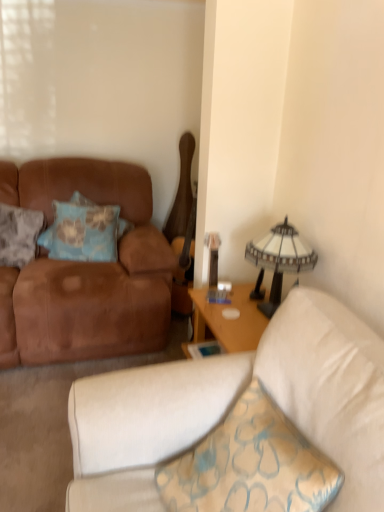
You are a GUI agent. You are given a task and a screenshot of the screen. Output one action in this format:
    pyautogui.click(x=<x>, y=<y>)
    Task: Click on the suede brown couch at left, the 1th studio couch viewed from the front
    
    Given the screenshot: What is the action you would take?
    pyautogui.click(x=230, y=404)

What do you see at coordinates (85, 271) in the screenshot? I see `brown suede couch at left, the 1th studio couch when ordered from back to front` at bounding box center [85, 271].

The width and height of the screenshot is (384, 512). Describe the element at coordinates (279, 260) in the screenshot. I see `white glass lampshade at upper right` at that location.

Image resolution: width=384 pixels, height=512 pixels. What do you see at coordinates (82, 231) in the screenshot?
I see `blue fabric pillow at left, arranged as the 1th pillow when viewed from the right` at bounding box center [82, 231].

Locate an element on the screen. textured blue pillow at left, positioned as the first pillow in left-to-right order is located at coordinates (19, 234).

Is white glass lampshade at upper right looking in the opposite direction of blue fabric pillow at left, arranged as the 1th pillow when viewed from the right?

That's not correct — white glass lampshade at upper right is not looking away from blue fabric pillow at left, arranged as the 1th pillow when viewed from the right.

Based on their sizes in the image, would you say white glass lampshade at upper right is bigger or smaller than blue fabric pillow at left, arranged as the 2th pillow when viewed from the left?

In the image, white glass lampshade at upper right appears to be smaller than blue fabric pillow at left, arranged as the 2th pillow when viewed from the left.

Does white glass lampshade at upper right have a lesser width compared to blue fabric pillow at left, arranged as the 1th pillow when viewed from the right?

Yes, white glass lampshade at upper right is thinner than blue fabric pillow at left, arranged as the 1th pillow when viewed from the right.

From a real-world perspective, relative to blue fabric pillow at left, arranged as the 1th pillow when viewed from the right, is white glass lampshade at upper right vertically above or below?

white glass lampshade at upper right is situated higher than blue fabric pillow at left, arranged as the 1th pillow when viewed from the right, in the real world.

Who is shorter, textured blue pillow at left, positioned as the first pillow in left-to-right order, or blue fabric pillow at left, arranged as the 2th pillow when viewed from the left?

With less height is blue fabric pillow at left, arranged as the 2th pillow when viewed from the left.

Between textured blue pillow at left, the 2th pillow when ordered from right to left, and blue fabric pillow at left, arranged as the 1th pillow when viewed from the right, which one has smaller size?

Smaller between the two is textured blue pillow at left, the 2th pillow when ordered from right to left.

Considering the sizes of textured blue pillow at left, positioned as the first pillow in left-to-right order, and blue fabric pillow at left, arranged as the 2th pillow when viewed from the left, in the image, is textured blue pillow at left, positioned as the first pillow in left-to-right order, wider or thinner than blue fabric pillow at left, arranged as the 2th pillow when viewed from the left,?

Clearly, textured blue pillow at left, positioned as the first pillow in left-to-right order, has more width compared to blue fabric pillow at left, arranged as the 2th pillow when viewed from the left.

What's the angular difference between blue fabric pillow at left, arranged as the 1th pillow when viewed from the right, and suede brown couch at left, the 1th studio couch viewed from the front,'s facing directions?

The facing directions of blue fabric pillow at left, arranged as the 1th pillow when viewed from the right, and suede brown couch at left, the 1th studio couch viewed from the front, are 76.5 degrees apart.

Would you consider blue fabric pillow at left, arranged as the 1th pillow when viewed from the right, to be distant from suede brown couch at left, the 1th studio couch viewed from the front?

Indeed, blue fabric pillow at left, arranged as the 1th pillow when viewed from the right, is not near suede brown couch at left, the 1th studio couch viewed from the front.

Who is smaller, blue fabric pillow at left, arranged as the 2th pillow when viewed from the left, or suede brown couch at left, the 1th studio couch viewed from the front?

blue fabric pillow at left, arranged as the 2th pillow when viewed from the left, is smaller.

Can you see textured blue pillow at left, the 2th pillow when ordered from right to left, touching suede brown couch at left, the second studio couch positioned from the back?

textured blue pillow at left, the 2th pillow when ordered from right to left, and suede brown couch at left, the second studio couch positioned from the back, are not in contact.

Is point (0, 230) less distant than point (136, 398)?

No, it is not.

Can you confirm if textured blue pillow at left, positioned as the first pillow in left-to-right order, is smaller than suede brown couch at left, the second studio couch positioned from the back?

Yes.

Is textured blue pillow at left, positioned as the first pillow in left-to-right order, oriented towards suede brown couch at left, the 1th studio couch viewed from the front?

No, textured blue pillow at left, positioned as the first pillow in left-to-right order, is not turned towards suede brown couch at left, the 1th studio couch viewed from the front.

Is white glass lampshade at upper right facing away from brown suede couch at left, the 1th studio couch when ordered from back to front?

white glass lampshade at upper right does not have its back to brown suede couch at left, the 1th studio couch when ordered from back to front.

What are the coordinates of `the 2nd studio couch to the left when counting from the white glass lampshade at upper right` in the screenshot? It's located at (85, 271).

From the image's perspective, would you say blue fabric pillow at left, arranged as the 1th pillow when viewed from the right, is positioned over brown suede couch at left, acting as the 2th studio couch starting from the front?

Yes, from the image's perspective, blue fabric pillow at left, arranged as the 1th pillow when viewed from the right, is on top of brown suede couch at left, acting as the 2th studio couch starting from the front.

Can you confirm if blue fabric pillow at left, arranged as the 2th pillow when viewed from the left, is positioned to the right of brown suede couch at left, the 1th studio couch when ordered from back to front?

Correct, you'll find blue fabric pillow at left, arranged as the 2th pillow when viewed from the left, to the right of brown suede couch at left, the 1th studio couch when ordered from back to front.

How much distance is there between blue fabric pillow at left, arranged as the 1th pillow when viewed from the right, and brown suede couch at left, acting as the 2th studio couch starting from the front?

A distance of 10.60 inches exists between blue fabric pillow at left, arranged as the 1th pillow when viewed from the right, and brown suede couch at left, acting as the 2th studio couch starting from the front.

Based on their sizes in the image, would you say blue fabric pillow at left, arranged as the 2th pillow when viewed from the left, is bigger or smaller than brown suede couch at left, the 1th studio couch when ordered from back to front?

blue fabric pillow at left, arranged as the 2th pillow when viewed from the left, is smaller than brown suede couch at left, the 1th studio couch when ordered from back to front.

Is point (136, 263) closer or farther from the camera than point (285, 222)?

Clearly, point (136, 263) is more distant from the camera than point (285, 222).

Can you confirm if brown suede couch at left, acting as the 2th studio couch starting from the front, is wider than white glass lampshade at upper right?

Yes.

Which object is positioned more to the right, brown suede couch at left, acting as the 2th studio couch starting from the front, or white glass lampshade at upper right?

Positioned to the right is white glass lampshade at upper right.

From a real-world perspective, relative to white glass lampshade at upper right, is brown suede couch at left, acting as the 2th studio couch starting from the front, vertically above or below?

brown suede couch at left, acting as the 2th studio couch starting from the front, is below white glass lampshade at upper right.

Where is `the 1st pillow to the left of the white glass lampshade at upper right, starting your count from the anchor`? the 1st pillow to the left of the white glass lampshade at upper right, starting your count from the anchor is located at coordinates (82, 231).

Locate an element on the screen. Image resolution: width=384 pixels, height=512 pixels. pillow that appears on the right of textured blue pillow at left, positioned as the first pillow in left-to-right order is located at coordinates (82, 231).

Considering their positions, is blue fabric pillow at left, arranged as the 2th pillow when viewed from the left, positioned closer to suede brown couch at left, the second studio couch positioned from the back, than white glass lampshade at upper right?

Among the two, white glass lampshade at upper right is located nearer to suede brown couch at left, the second studio couch positioned from the back.

When comparing their distances from white glass lampshade at upper right, does textured blue pillow at left, the 2th pillow when ordered from right to left, or brown suede couch at left, acting as the 2th studio couch starting from the front, seem further?

The object further to white glass lampshade at upper right is textured blue pillow at left, the 2th pillow when ordered from right to left.

From the picture: Considering their positions, is white glass lampshade at upper right positioned further to blue fabric pillow at left, arranged as the 2th pillow when viewed from the left, than textured blue pillow at left, positioned as the first pillow in left-to-right order?

Based on the image, white glass lampshade at upper right appears to be further to blue fabric pillow at left, arranged as the 2th pillow when viewed from the left.

Looking at the image, which one is located further to white glass lampshade at upper right, brown suede couch at left, acting as the 2th studio couch starting from the front, or suede brown couch at left, the second studio couch positioned from the back?

brown suede couch at left, acting as the 2th studio couch starting from the front, lies further to white glass lampshade at upper right than the other object.

Which object lies further to the anchor point textured blue pillow at left, positioned as the first pillow in left-to-right order, blue fabric pillow at left, arranged as the 1th pillow when viewed from the right, or white glass lampshade at upper right?

The object further to textured blue pillow at left, positioned as the first pillow in left-to-right order, is white glass lampshade at upper right.

When comparing their distances from blue fabric pillow at left, arranged as the 1th pillow when viewed from the right, does suede brown couch at left, the second studio couch positioned from the back, or white glass lampshade at upper right seem further?

suede brown couch at left, the second studio couch positioned from the back, is further to blue fabric pillow at left, arranged as the 1th pillow when viewed from the right.

From the image, which object appears to be farther from suede brown couch at left, the 1th studio couch viewed from the front, blue fabric pillow at left, arranged as the 2th pillow when viewed from the left, or brown suede couch at left, the 1th studio couch when ordered from back to front?

blue fabric pillow at left, arranged as the 2th pillow when viewed from the left, is positioned further to the anchor suede brown couch at left, the 1th studio couch viewed from the front.

When comparing their distances from suede brown couch at left, the 1th studio couch viewed from the front, does white glass lampshade at upper right or brown suede couch at left, the 1th studio couch when ordered from back to front, seem further?

Among the two, brown suede couch at left, the 1th studio couch when ordered from back to front, is located further to suede brown couch at left, the 1th studio couch viewed from the front.

Identify the location of studio couch between suede brown couch at left, the second studio couch positioned from the back, and textured blue pillow at left, positioned as the first pillow in left-to-right order, from front to back. (85, 271).

Where is `lamp between suede brown couch at left, the second studio couch positioned from the back, and textured blue pillow at left, positioned as the first pillow in left-to-right order, along the z-axis`? lamp between suede brown couch at left, the second studio couch positioned from the back, and textured blue pillow at left, positioned as the first pillow in left-to-right order, along the z-axis is located at coordinates (279, 260).

The image size is (384, 512). Identify the location of studio couch between suede brown couch at left, the 1th studio couch viewed from the front, and blue fabric pillow at left, arranged as the 1th pillow when viewed from the right, along the z-axis. (85, 271).

I want to click on lamp located between suede brown couch at left, the second studio couch positioned from the back, and blue fabric pillow at left, arranged as the 2th pillow when viewed from the left, in the depth direction, so click(279, 260).